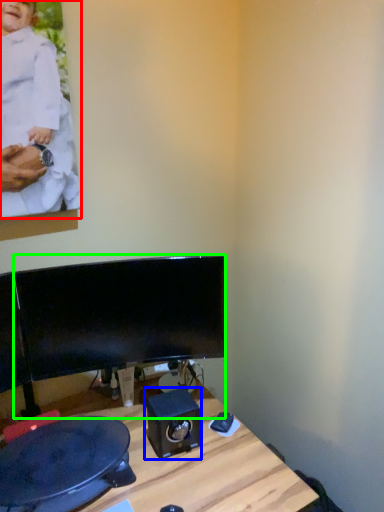
Question: Which object is positioned farthest from person (highlighted by a red box)? Select from speaker (highlighted by a blue box) and computer monitor (highlighted by a green box).

Choices:
 (A) speaker
 (B) computer monitor

Answer: (A)